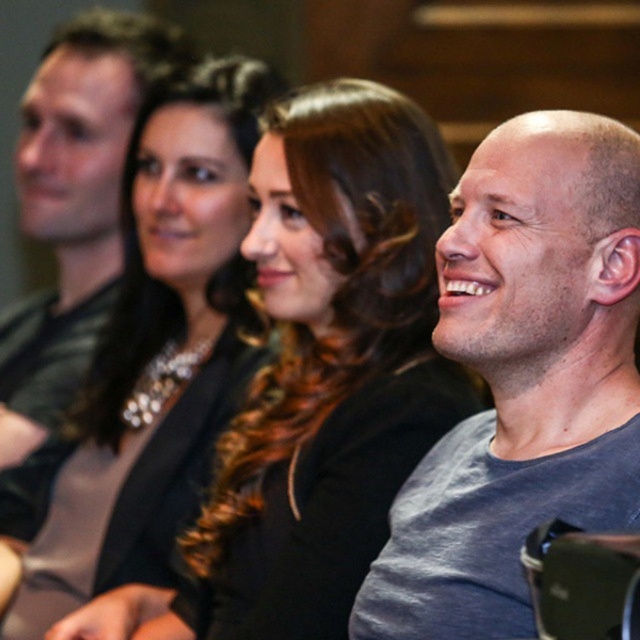
Can you confirm if gray cotton t-shirt at center is shorter than black satin jacket at upper center?

Yes.

Is point (609, 472) farther from camera compared to point (140, 577)?

No.

Who is more forward, (586, 268) or (172, 532)?

Point (586, 268) is more forward.

Image resolution: width=640 pixels, height=640 pixels. In order to click on gray cotton t-shirt at center in this screenshot , I will do `click(522, 380)`.

Is matte black jacket at center positioned behind black satin jacket at upper center?

No, it is in front of black satin jacket at upper center.

Which is in front, point (412, 192) or point (198, 340)?

Point (412, 192) is more forward.

Between point (356, 138) and point (208, 216), which one is positioned in front?

Point (356, 138)

Locate an element on the screen. Image resolution: width=640 pixels, height=640 pixels. matte black jacket at center is located at coordinates (317, 378).

Does matte black jacket at center appear over gray cotton t-shirt at center?

No.

Measure the distance between matte black jacket at center and gray cotton t-shirt at center.

matte black jacket at center is 37.55 centimeters away from gray cotton t-shirt at center.

Describe the element at coordinates (317, 378) in the screenshot. I see `matte black jacket at center` at that location.

This screenshot has width=640, height=640. I want to click on matte black jacket at center, so click(x=317, y=378).